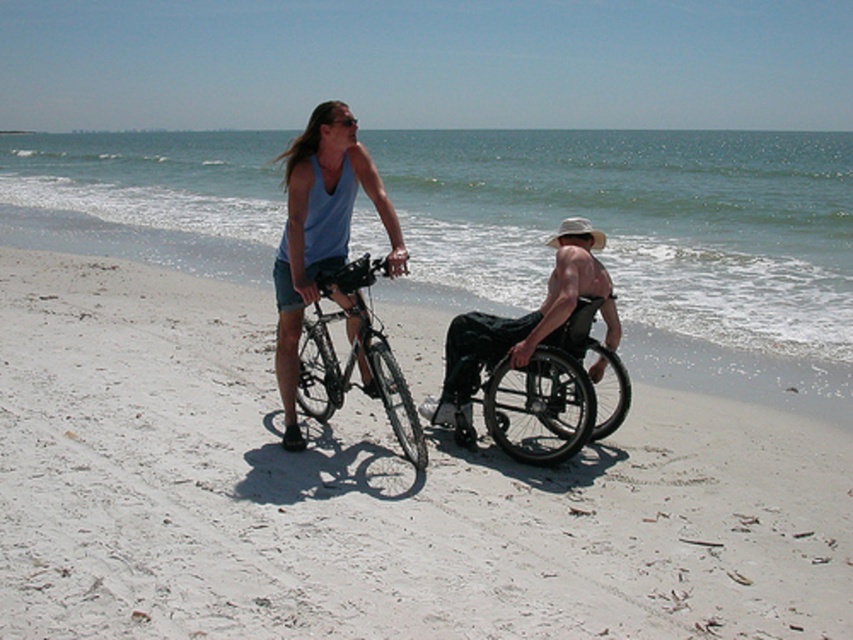
Question: Is matte blue tank top at center bigger than black matte wheelchair at center?

Choices:
 (A) yes
 (B) no

Answer: (B)

Question: Which of these objects is positioned farthest from the matte blue tank top at center?

Choices:
 (A) white sand at center
 (B) black matte wheelchair at center
 (C) black plastic wheelchair at center
 (D) white sand at lower center

Answer: (D)

Question: Based on their relative distances, which object is farther from the silver metallic bicycle at center?

Choices:
 (A) matte blue tank top at center
 (B) white sand at lower center
 (C) white sand at center

Answer: (B)

Question: Which object is closer to the camera taking this photo?

Choices:
 (A) white sand at center
 (B) white sand at lower center
 (C) black plastic wheelchair at center

Answer: (A)

Question: Is matte blue tank top at center wider than black matte wheelchair at center?

Choices:
 (A) yes
 (B) no

Answer: (B)

Question: Is white sand at lower center positioned in front of matte blue tank top at center?

Choices:
 (A) yes
 (B) no

Answer: (B)